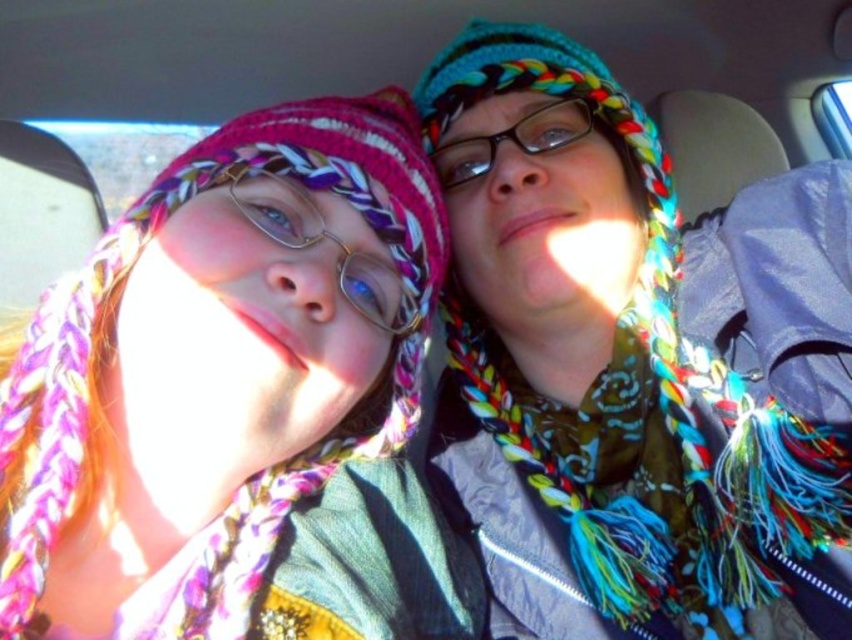
Question: Which point is closer to the camera?

Choices:
 (A) matte pink scarf at left
 (B) transparent plastic glasses at center

Answer: (A)

Question: Which object is closer to the camera taking this photo?

Choices:
 (A) matte pink scarf at left
 (B) transparent plastic glasses at center

Answer: (A)

Question: Is the position of matte pink scarf at left less distant than that of transparent plastic glasses at center?

Choices:
 (A) yes
 (B) no

Answer: (A)

Question: Which is farther from the matte pink scarf at left?

Choices:
 (A) multicolored knitted hat at center
 (B) transparent plastic glasses at center

Answer: (B)

Question: Can you confirm if multicolored knitted hat at center is positioned to the right of matte pink scarf at left?

Choices:
 (A) yes
 (B) no

Answer: (A)

Question: Can you confirm if multicolored knitted hat at center is positioned to the right of transparent plastic glasses at center?

Choices:
 (A) no
 (B) yes

Answer: (B)